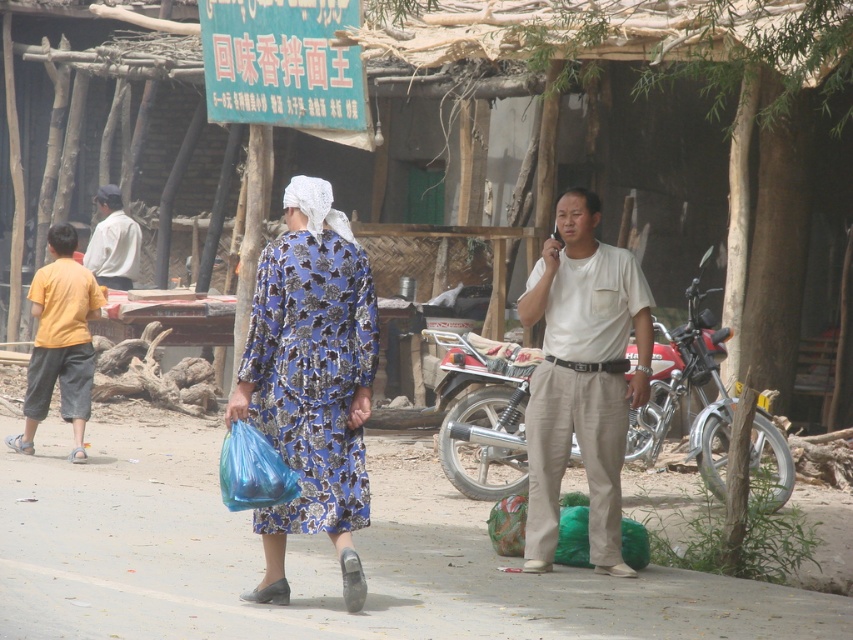
Is blue floral dress at center shorter than yellow cotton shirt at left?

Correct, blue floral dress at center is not as tall as yellow cotton shirt at left.

Between blue floral dress at center and yellow cotton shirt at left, which one is positioned higher?

Positioned higher is yellow cotton shirt at left.

The width and height of the screenshot is (853, 640). Find the location of `blue floral dress at center`. blue floral dress at center is located at coordinates (312, 376).

Does point (274, 380) come in front of point (668, 348)?

Yes, it is.

Does blue floral dress at center have a greater width compared to red matte motorcycle at center?

Incorrect, blue floral dress at center's width does not surpass red matte motorcycle at center's.

The height and width of the screenshot is (640, 853). Identify the location of blue floral dress at center. (312, 376).

Which is behind, point (552, 458) or point (329, 365)?

The point (552, 458) is more distant.

Does white cotton shirt at center have a larger size compared to blue floral dress at center?

Yes.

Where is `white cotton shirt at center`? Image resolution: width=853 pixels, height=640 pixels. white cotton shirt at center is located at coordinates (582, 378).